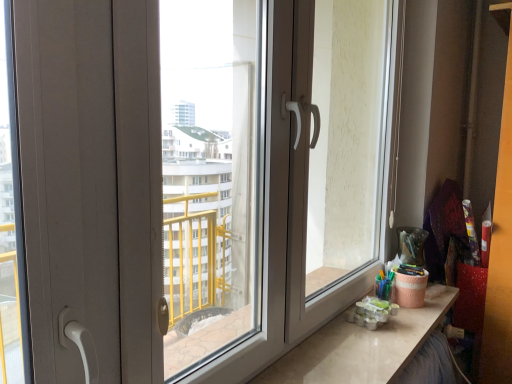
Question: Can you confirm if matte white screen door at right is bigger than matte white counter top at lower right?

Choices:
 (A) no
 (B) yes

Answer: (B)

Question: Does matte white screen door at right lie in front of matte white counter top at lower right?

Choices:
 (A) yes
 (B) no

Answer: (B)

Question: Can you confirm if matte white screen door at right is thinner than matte white counter top at lower right?

Choices:
 (A) no
 (B) yes

Answer: (B)

Question: Is matte white screen door at right not near matte white counter top at lower right?

Choices:
 (A) yes
 (B) no

Answer: (B)

Question: From a real-world perspective, is matte white screen door at right positioned over matte white counter top at lower right based on gravity?

Choices:
 (A) yes
 (B) no

Answer: (A)

Question: From the image's perspective, relative to matte white counter top at lower right, is transparent plastic window screen at center above or below?

Choices:
 (A) below
 (B) above

Answer: (B)

Question: From a real-world perspective, is transparent plastic window screen at center positioned above or below matte white counter top at lower right?

Choices:
 (A) below
 (B) above

Answer: (B)

Question: Considering the relative positions of transparent plastic window screen at center and matte white counter top at lower right in the image provided, is transparent plastic window screen at center to the left or to the right of matte white counter top at lower right?

Choices:
 (A) right
 (B) left

Answer: (B)

Question: Is transparent plastic window screen at center wider or thinner than matte white counter top at lower right?

Choices:
 (A) wide
 (B) thin

Answer: (B)

Question: Considering the relative positions of matte white screen door at right and transparent plastic window screen at center in the image provided, is matte white screen door at right to the left or to the right of transparent plastic window screen at center?

Choices:
 (A) right
 (B) left

Answer: (A)

Question: From a real-world perspective, is matte white screen door at right above or below transparent plastic window screen at center?

Choices:
 (A) above
 (B) below

Answer: (A)

Question: In terms of size, does matte white screen door at right appear bigger or smaller than transparent plastic window screen at center?

Choices:
 (A) small
 (B) big

Answer: (B)

Question: From the image's perspective, is matte white screen door at right positioned above or below transparent plastic window screen at center?

Choices:
 (A) below
 (B) above

Answer: (B)

Question: From a real-world perspective, relative to matte white screen door at right, is transparent plastic window screen at center vertically above or below?

Choices:
 (A) below
 (B) above

Answer: (A)

Question: Is transparent plastic window screen at center situated inside matte white screen door at right or outside?

Choices:
 (A) inside
 (B) outside

Answer: (B)